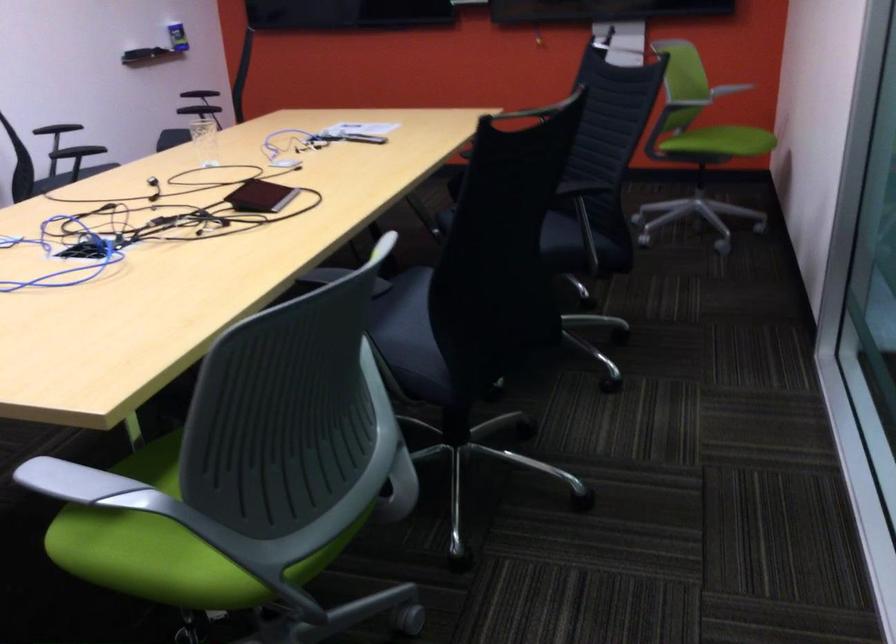
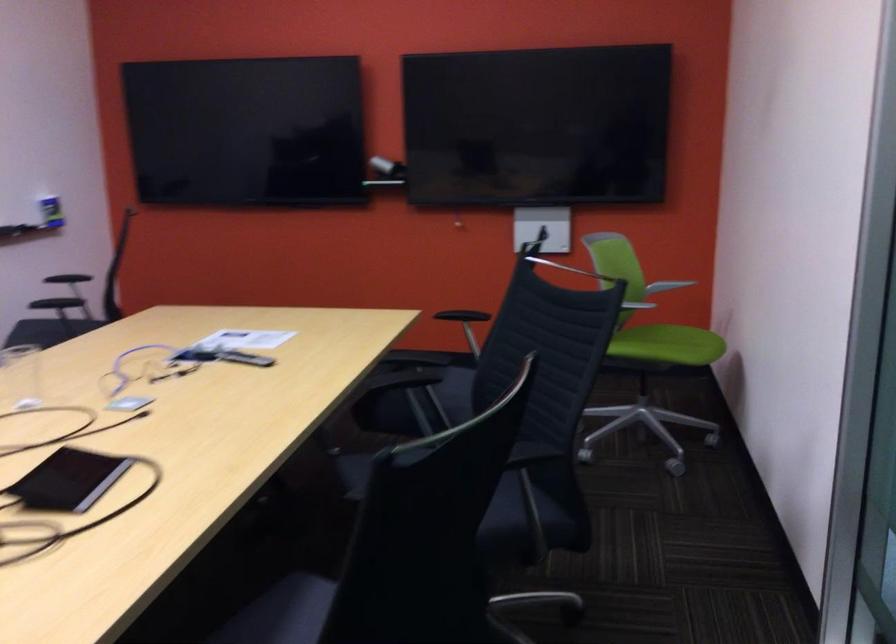
Question: The images are taken continuously from a first-person perspective. In which direction is your viewpoint rotating?

Choices:
 (A) Left
 (B) Right
 (C) Up
 (D) Down

Answer: (C)